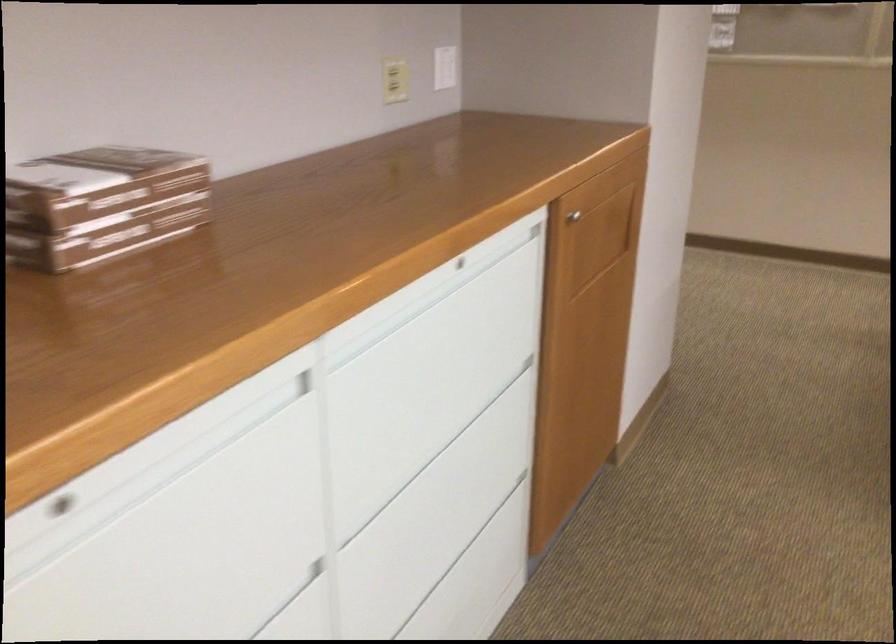
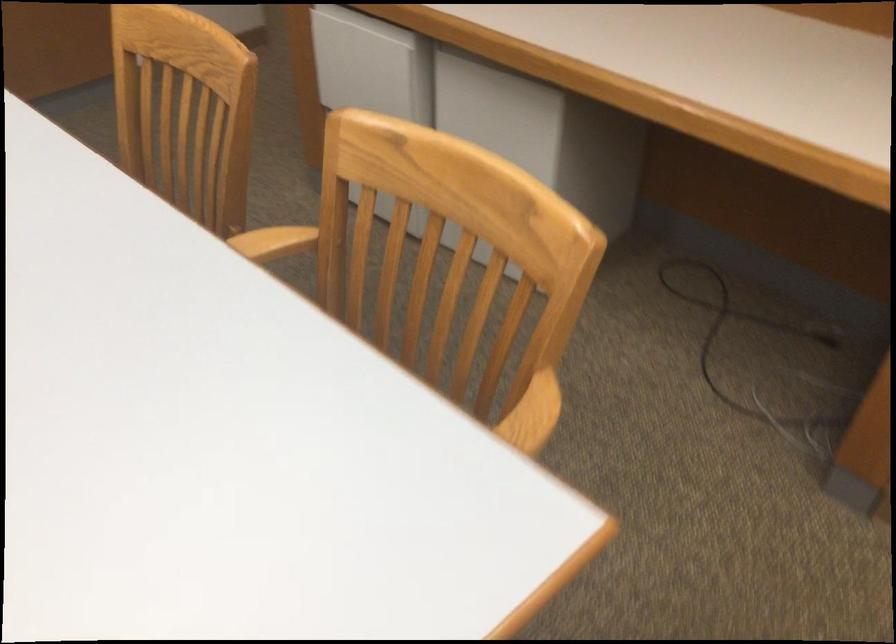
Question: Which direction would the cameraman need to move to produce the second image? Reply with the corresponding letter.

Choices:
 (A) Left
 (B) Right
 (C) Forward
 (D) Backward

Answer: (B)